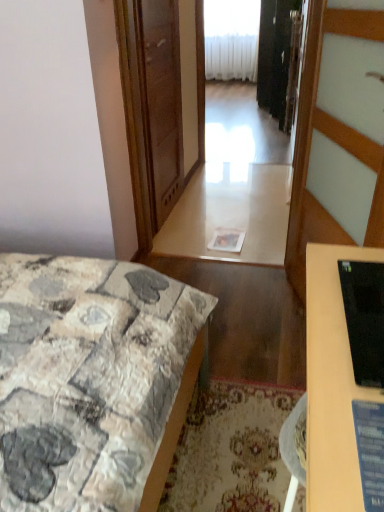
Question: From the image's perspective, would you say white glossy table at center is positioned over black glossy monitor at right?

Choices:
 (A) yes
 (B) no

Answer: (A)

Question: Is white glossy table at center smaller than black glossy monitor at right?

Choices:
 (A) yes
 (B) no

Answer: (B)

Question: From a real-world perspective, is white glossy table at center on top of black glossy monitor at right?

Choices:
 (A) no
 (B) yes

Answer: (A)

Question: Is white glossy table at center at the right side of black glossy monitor at right?

Choices:
 (A) yes
 (B) no

Answer: (B)

Question: Is white glossy table at center touching black glossy monitor at right?

Choices:
 (A) no
 (B) yes

Answer: (A)

Question: Is black glossy monitor at right at the back of white glossy table at center?

Choices:
 (A) yes
 (B) no

Answer: (B)

Question: Can you confirm if black glossy monitor at right is wider than transparent glass screen door at center?

Choices:
 (A) no
 (B) yes

Answer: (B)

Question: Is black glossy monitor at right not close to transparent glass screen door at center?

Choices:
 (A) no
 (B) yes

Answer: (B)

Question: Is black glossy monitor at right positioned in front of transparent glass screen door at center?

Choices:
 (A) no
 (B) yes

Answer: (B)

Question: From the image's perspective, is black glossy monitor at right located beneath transparent glass screen door at center?

Choices:
 (A) yes
 (B) no

Answer: (A)

Question: Is black glossy monitor at right outside transparent glass screen door at center?

Choices:
 (A) no
 (B) yes

Answer: (B)

Question: Is black glossy monitor at right oriented away from transparent glass screen door at center?

Choices:
 (A) no
 (B) yes

Answer: (A)

Question: Considering the relative sizes of transparent glass screen door at center and white plastic radiator at upper center in the image provided, is transparent glass screen door at center wider than white plastic radiator at upper center?

Choices:
 (A) yes
 (B) no

Answer: (B)